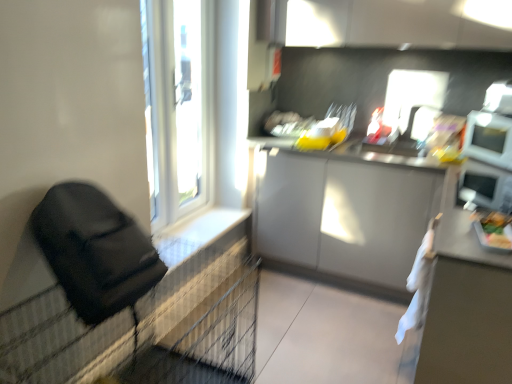
At what (x,y) coordinates should I click in order to perform the action: click on free space to the left of green matte tray at right. Please return your answer as a coordinate pair (x, y). This screenshot has height=384, width=512. Looking at the image, I should click on (454, 234).